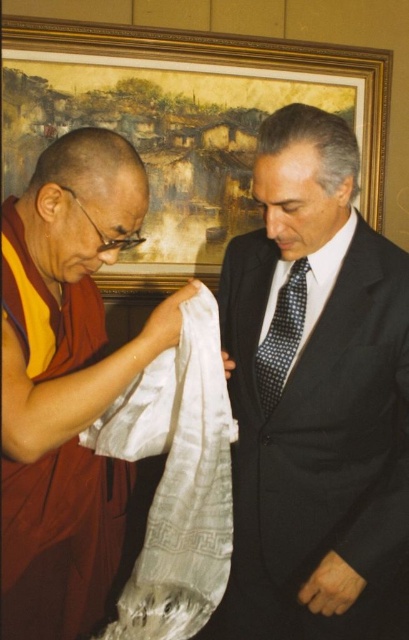
Which of these two, gold-framed painting at upper center or polka dot silk tie at center, stands shorter?

polka dot silk tie at center is shorter.

In order to click on gold-framed painting at upper center in this screenshot , I will do `click(190, 120)`.

Which is in front, point (177, 193) or point (287, 364)?

Point (287, 364) is in front.

At what (x,y) coordinates should I click in order to perform the action: click on gold-framed painting at upper center. Please return your answer as a coordinate pair (x, y). This screenshot has height=640, width=409. Looking at the image, I should click on (190, 120).

How far apart are silky white cloth at center and matte silk scarf at left?

The distance of silky white cloth at center from matte silk scarf at left is 13.95 inches.

Does silky white cloth at center appear over matte silk scarf at left?

Actually, silky white cloth at center is below matte silk scarf at left.

This screenshot has width=409, height=640. What do you see at coordinates (314, 394) in the screenshot? I see `silky white cloth at center` at bounding box center [314, 394].

Locate an element on the screen. silky white cloth at center is located at coordinates (314, 394).

Does silky white cloth at center appear on the left side of gold-framed painting at upper center?

No, silky white cloth at center is not to the left of gold-framed painting at upper center.

Which is below, silky white cloth at center or gold-framed painting at upper center?

silky white cloth at center is lower down.

What do you see at coordinates (314, 394) in the screenshot? This screenshot has height=640, width=409. I see `silky white cloth at center` at bounding box center [314, 394].

The image size is (409, 640). I want to click on silky white cloth at center, so click(x=314, y=394).